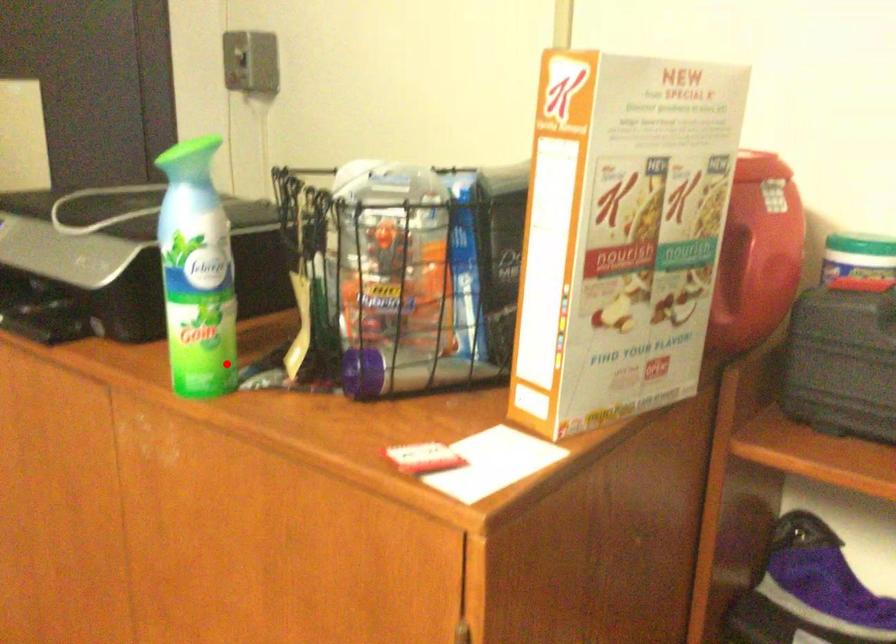
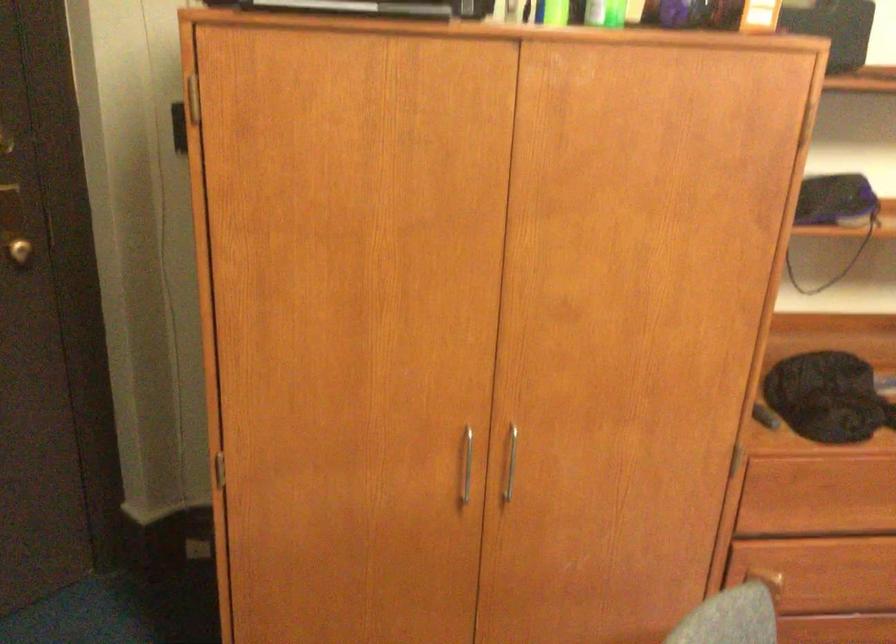
Locate, in the second image, the point that corresponds to the highlighted location in the first image.

(556, 13)